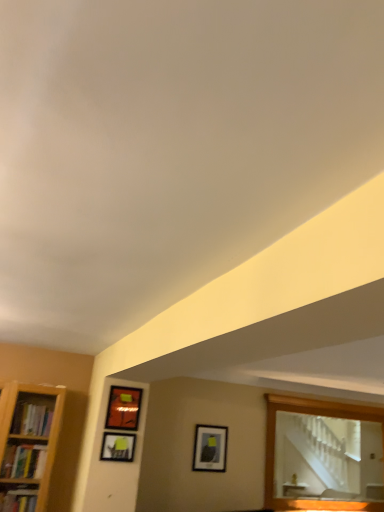
Question: Is point (114, 454) positioned closer to the camera than point (125, 425)?

Choices:
 (A) farther
 (B) closer

Answer: (B)

Question: Based on their positions, is matte black picture frame at upper center, which is the 3th picture frame in right-to-left order, located to the left or right of matte orange picture frame at upper left, the second picture frame positioned from the front?

Choices:
 (A) left
 (B) right

Answer: (A)

Question: Which object is the closest to the matte orange picture frame at upper left, which is the 3th picture frame in bottom-to-top order?

Choices:
 (A) matte black picture frame at center, which is counted as the first picture frame, starting from the bottom
 (B) matte black picture frame at upper center, the 1th picture frame positioned from the front
 (C) wooden mirror at upper right

Answer: (B)

Question: Based on their relative distances, which object is nearer to the wooden mirror at upper right?

Choices:
 (A) matte black picture frame at center, which is the 3th picture frame from left to right
 (B) matte black picture frame at upper center, which is the 3th picture frame in right-to-left order
 (C) matte orange picture frame at upper left, the second picture frame positioned from the front

Answer: (A)